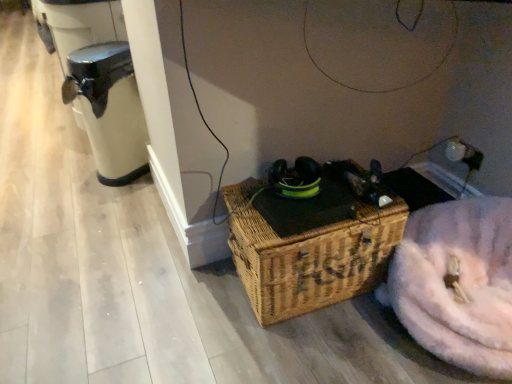
Image resolution: width=512 pixels, height=384 pixels. In order to click on empty space that is ontop of woven brown picnic basket at center (from a real-world perspective) in this screenshot , I will do `click(314, 200)`.